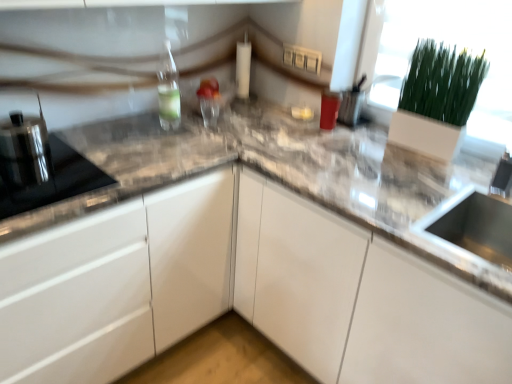
Question: From the image's perspective, is white matte glass door at upper right under matte plastic container at upper right, placed as the third appliance when sorted from left to right?

Choices:
 (A) yes
 (B) no

Answer: (A)

Question: Can you see white matte glass door at upper right touching matte plastic container at upper right, which ranks as the third appliance in front-to-back order?

Choices:
 (A) yes
 (B) no

Answer: (B)

Question: Can you confirm if white matte glass door at upper right is positioned to the left of matte plastic container at upper right, the first appliance in the back-to-front sequence?

Choices:
 (A) no
 (B) yes

Answer: (A)

Question: Does white matte glass door at upper right have a greater height compared to matte plastic container at upper right, which ranks as the third appliance in front-to-back order?

Choices:
 (A) no
 (B) yes

Answer: (B)

Question: Does white matte glass door at upper right have a larger size compared to matte plastic container at upper right, the first appliance in the back-to-front sequence?

Choices:
 (A) no
 (B) yes

Answer: (B)

Question: Is white glossy cabinet at center in front of or behind matte plastic container at upper right, the 1th appliance when ordered from right to left, in the image?

Choices:
 (A) front
 (B) behind

Answer: (A)

Question: Looking at the image, does white glossy cabinet at center seem bigger or smaller compared to matte plastic container at upper right, the 1th appliance when ordered from right to left?

Choices:
 (A) small
 (B) big

Answer: (B)

Question: Considering the positions of point (142, 281) and point (340, 107), is point (142, 281) closer or farther from the camera than point (340, 107)?

Choices:
 (A) farther
 (B) closer

Answer: (B)

Question: In terms of width, does white glossy cabinet at center look wider or thinner when compared to matte plastic container at upper right, which ranks as the third appliance in front-to-back order?

Choices:
 (A) wide
 (B) thin

Answer: (A)

Question: Considering the positions of point (508, 130) and point (55, 145), is point (508, 130) closer or farther from the camera than point (55, 145)?

Choices:
 (A) closer
 (B) farther

Answer: (B)

Question: From a real-world perspective, relative to black glass cooktop at left, which is the 1th appliance in front-to-back order, is white matte glass door at upper right vertically above or below?

Choices:
 (A) above
 (B) below

Answer: (A)

Question: Is white matte glass door at upper right in front of or behind black glass cooktop at left, which ranks as the 2th appliance in right-to-left order, in the image?

Choices:
 (A) front
 (B) behind

Answer: (B)

Question: In the image, is white matte glass door at upper right on the left side or the right side of black glass cooktop at left, the 2th appliance in the left-to-right sequence?

Choices:
 (A) left
 (B) right

Answer: (B)

Question: From a real-world perspective, relative to matte plastic container at upper right, the first appliance in the back-to-front sequence, is satin black kettle at left, arranged as the third appliance when viewed from the right, vertically above or below?

Choices:
 (A) below
 (B) above

Answer: (B)

Question: From the image's perspective, relative to matte plastic container at upper right, which ranks as the third appliance in front-to-back order, is satin black kettle at left, which is the 2th appliance from back to front, above or below?

Choices:
 (A) below
 (B) above

Answer: (A)